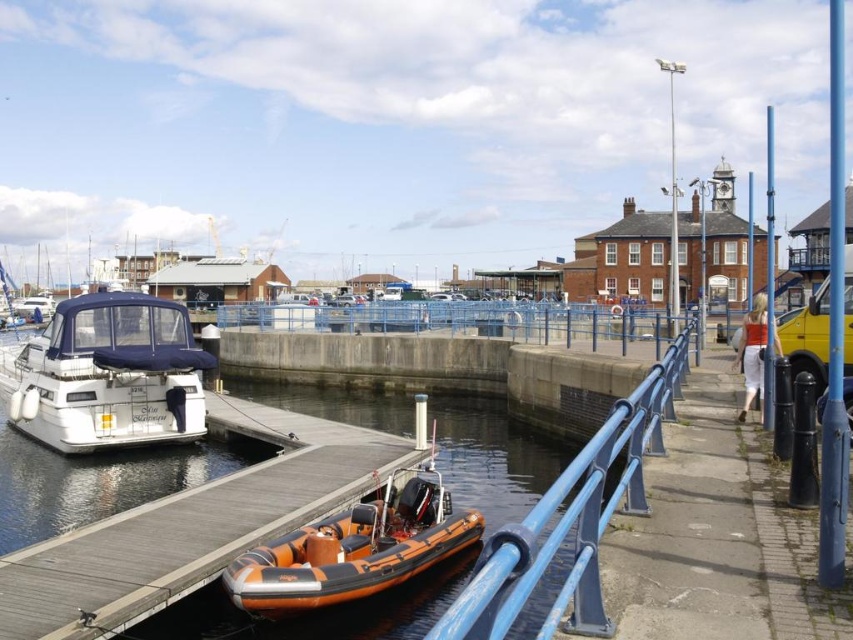
Between white matte boat at left and blue metallic rail at center, which one has less height?

white matte boat at left is shorter.

Which of these two, white matte boat at left or blue metallic rail at center, stands taller?

blue metallic rail at center is taller.

Is point (164, 380) more distant than point (482, 618)?

Yes, point (164, 380) is farther from viewer.

Locate an element on the screen. This screenshot has width=853, height=640. white matte boat at left is located at coordinates (107, 376).

Is white matte boat at left shorter than orange rubber boat at lower center?

No.

This screenshot has width=853, height=640. Identify the location of white matte boat at left. (107, 376).

The width and height of the screenshot is (853, 640). Identify the location of blue metallic rail at center. (572, 520).

Is point (577, 564) more distant than point (425, 396)?

No, (577, 564) is in front of (425, 396).

Which is behind, point (641, 401) or point (345, 570)?

The point (345, 570) is more distant.

This screenshot has width=853, height=640. Identify the location of blue metallic rail at center. (572, 520).